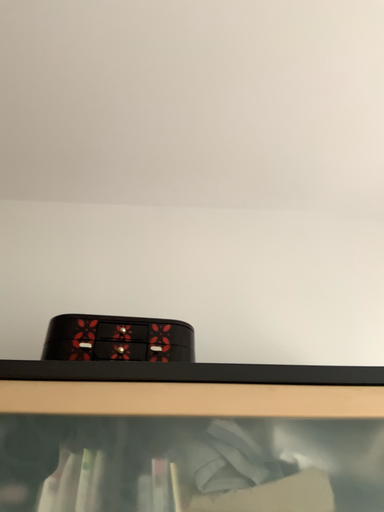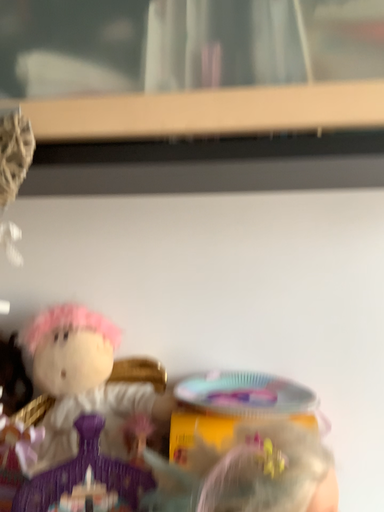
Question: Which way did the camera rotate in the video?

Choices:
 (A) rotated downward
 (B) rotated upward

Answer: (A)